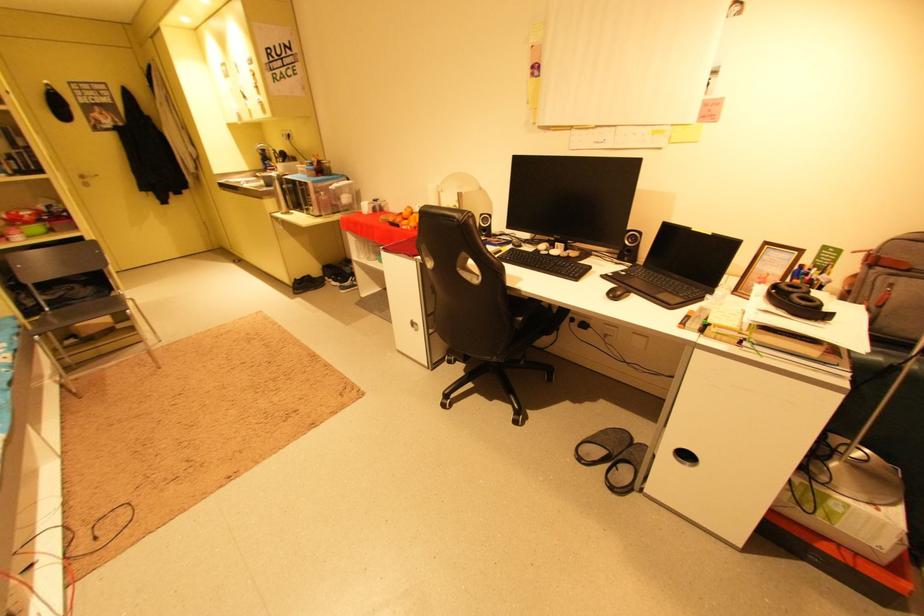
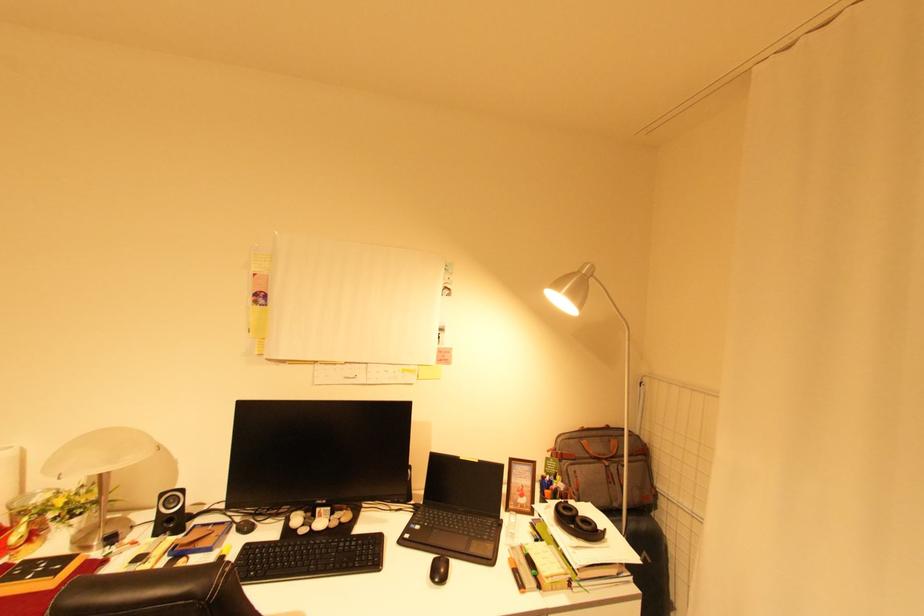
In the second image, find the point that corresponds to point (718, 235) in the first image.

(484, 462)